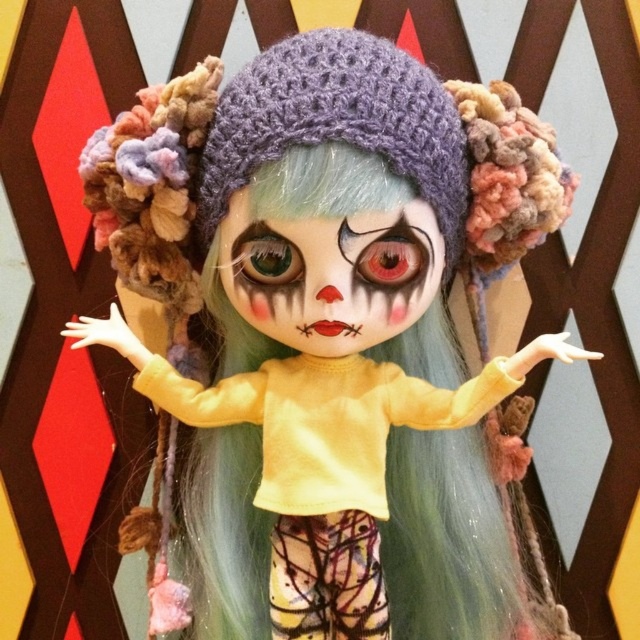
Is point (458, 248) positioned before point (408, 208)?

No, (458, 248) is behind (408, 208).

Which is behind, point (332, 70) or point (228, 212)?

The point (228, 212) is more distant.

This screenshot has width=640, height=640. Describe the element at coordinates (339, 124) in the screenshot. I see `purple knitted hat at center` at that location.

This screenshot has width=640, height=640. I want to click on purple knitted hat at center, so click(339, 124).